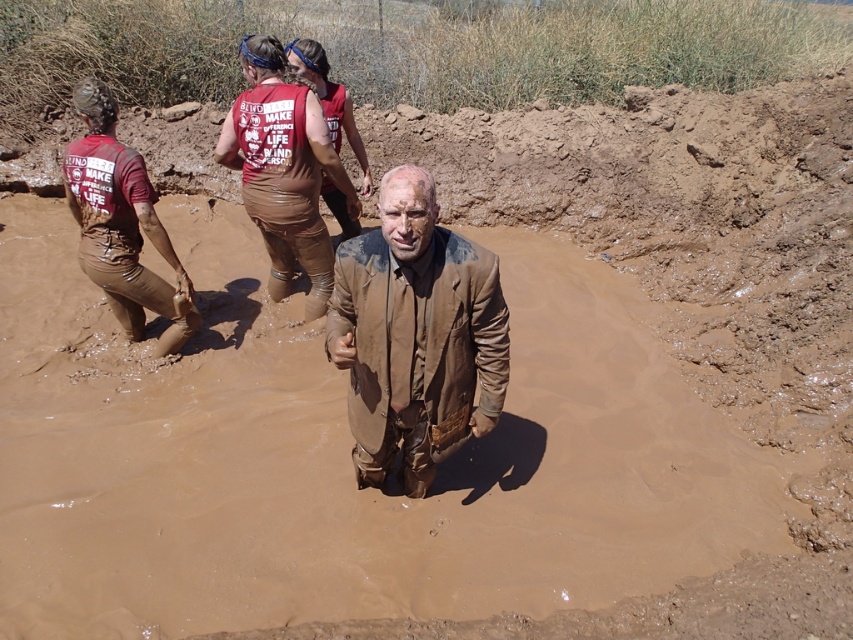
Based on the photo, is muddy brown suit at center further to camera compared to matte brown vest at center?

No.

Does muddy brown suit at center appear on the right side of matte brown vest at center?

Indeed, muddy brown suit at center is positioned on the right side of matte brown vest at center.

This screenshot has height=640, width=853. Describe the element at coordinates (415, 333) in the screenshot. I see `muddy brown suit at center` at that location.

Where is `muddy brown suit at center`? The image size is (853, 640). muddy brown suit at center is located at coordinates (415, 333).

Based on the photo, does matte brown vest at center lie behind muddy brown pants at left?

Yes.

Is matte brown vest at center taller than muddy brown pants at left?

Yes, matte brown vest at center is taller than muddy brown pants at left.

What do you see at coordinates (283, 170) in the screenshot?
I see `matte brown vest at center` at bounding box center [283, 170].

Locate an element on the screen. Image resolution: width=853 pixels, height=640 pixels. matte brown vest at center is located at coordinates [283, 170].

Who is more forward, (447, 317) or (86, 92)?

Point (447, 317) is more forward.

Is point (459, 429) farther from camera compared to point (137, 275)?

No, (459, 429) is closer to viewer.

Locate an element on the screen. The height and width of the screenshot is (640, 853). muddy brown suit at center is located at coordinates (415, 333).